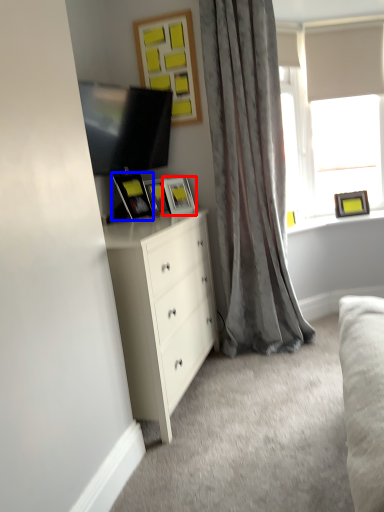
Question: Which of the following is the farthest to the observer, picture frame (highlighted by a red box) or picture frame (highlighted by a blue box)?

Choices:
 (A) picture frame
 (B) picture frame

Answer: (A)